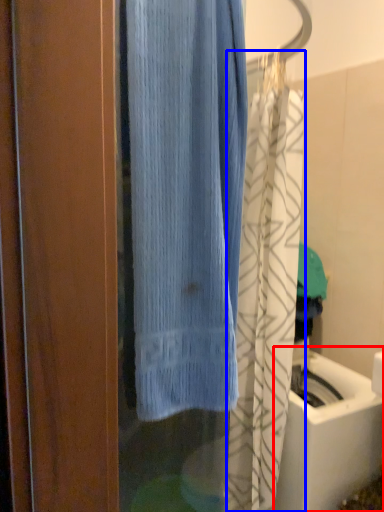
Question: Which point is closer to the camera, sink (highlighted by a red box) or shower curtain (highlighted by a blue box)?

Choices:
 (A) sink
 (B) shower curtain

Answer: (B)